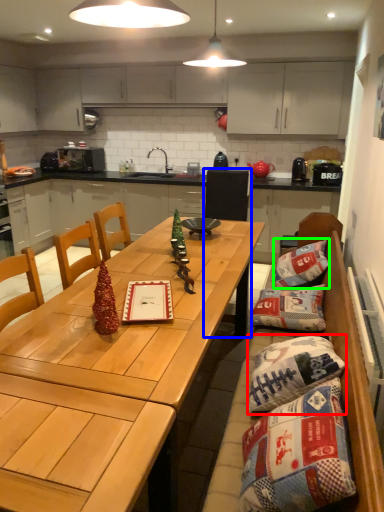
Question: Which is nearer to the pillow (highlighted by a red box)? chair (highlighted by a blue box) or pillow (highlighted by a green box).

Choices:
 (A) chair
 (B) pillow

Answer: (B)